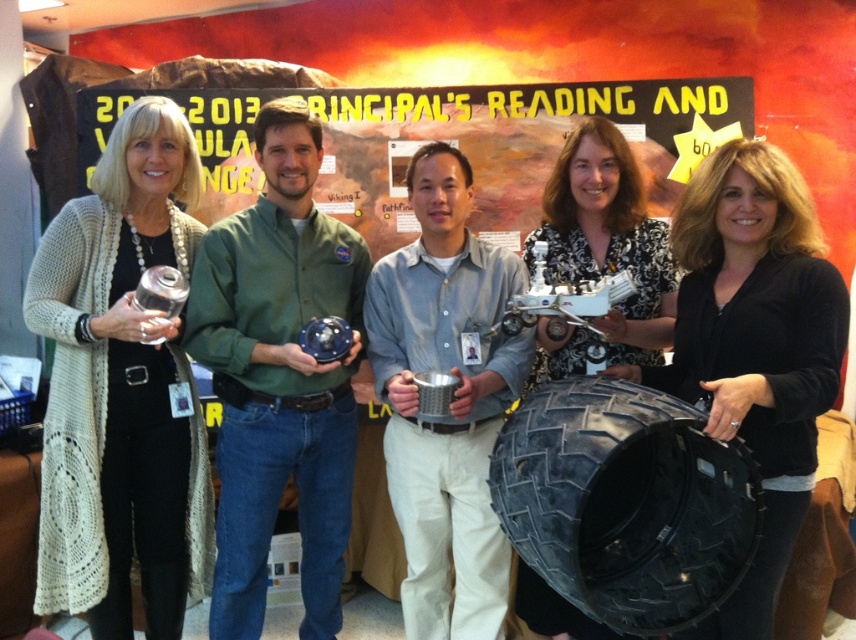
You are taking a photo of the group and want to focus on both the point at point (120, 486) and the point at point (539, 353). Which point should you adjust your focus to first to ensure both are in clear view?

You should focus on point (120, 486) first because it is closer to the camera than point (539, 353). This way, adjusting focus from near to far will help both points come into clear view.

In the scene shown: You are organizing a group photo and need to arrange the participants so that the green matte shirt at center and the black floral blouse at center are visible. Based on their heights, which one should be placed in the front to ensure both are visible?

The black floral blouse at center should be placed in the front because the green matte shirt at center is taller. This way, the taller person can stand behind the shorter one, ensuring both are visible in the photo.

You are organizing a clothing donation drive and need to determine which of the two items, the white knitted cardigan at left or the black floral blouse at center, can fit into a standard donation box that accommodates garments up to the size of the larger item. Which item should you prioritize placing first?

The white knitted cardigan at left is larger in size than the black floral blouse at center, so you should prioritize placing the white knitted cardigan at left first since it requires more space and the donation box can accommodate its size.